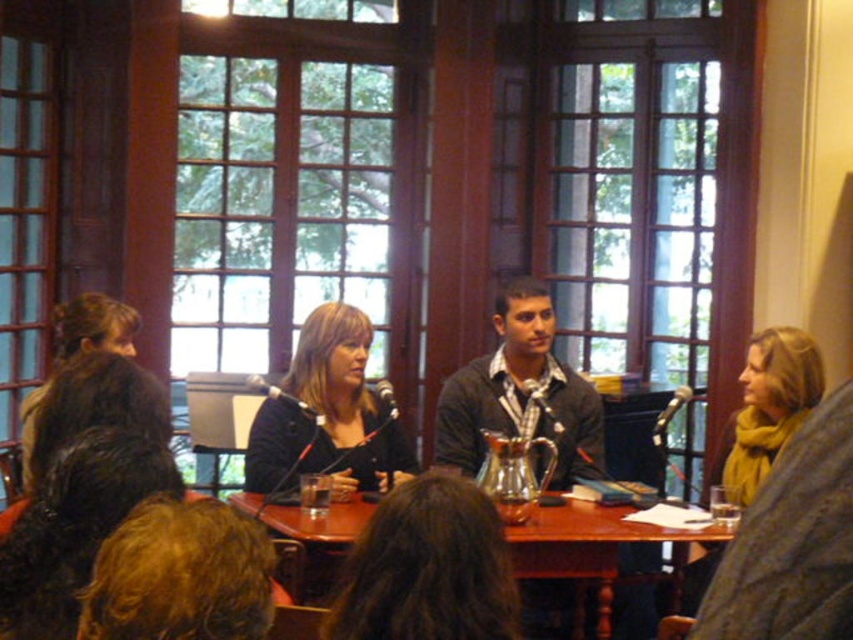
Question: Does mustard yellow scarf at right appear on the right side of wooden table at center?

Choices:
 (A) yes
 (B) no

Answer: (A)

Question: Which point is farther to the camera?

Choices:
 (A) (415, 611)
 (B) (244, 468)
 (C) (622, 524)
 (D) (804, 397)

Answer: (B)

Question: Which point is closer to the camera taking this photo?

Choices:
 (A) (428, 611)
 (B) (550, 516)
 (C) (749, 448)
 (D) (311, 324)

Answer: (A)

Question: Can you confirm if matte black pitcher at center is positioned below matte black jacket at center?

Choices:
 (A) no
 (B) yes

Answer: (B)

Question: Where is dark gray sweater at center located in relation to mustard yellow scarf at right in the image?

Choices:
 (A) above
 (B) below

Answer: (A)

Question: Which of the following is the farthest from the observer?

Choices:
 (A) (654, 531)
 (B) (490, 404)
 (C) (431, 588)
 (D) (277, 444)

Answer: (B)